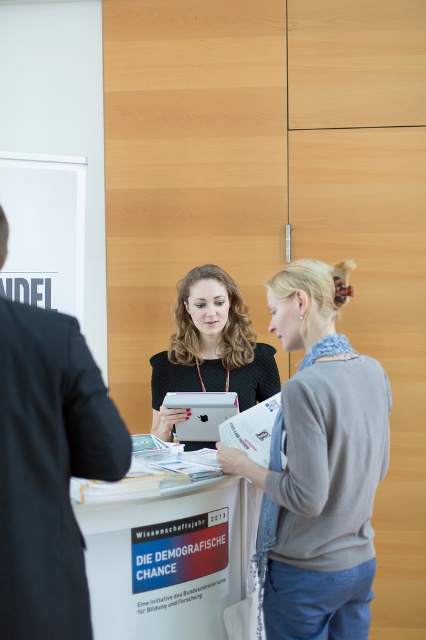
Question: Is gray sweater at center wider than white cardboard sign at center?

Choices:
 (A) no
 (B) yes

Answer: (A)

Question: Can you confirm if black suit at left is positioned below matte black tablet at center?

Choices:
 (A) no
 (B) yes

Answer: (B)

Question: Which point appears closest to the camera in this image?

Choices:
 (A) (210, 636)
 (B) (339, 534)
 (C) (199, 358)

Answer: (B)

Question: Can you confirm if white cardboard sign at center is smaller than matte black tablet at center?

Choices:
 (A) no
 (B) yes

Answer: (A)

Question: Which point appears closest to the camera in this image?

Choices:
 (A) (17, 470)
 (B) (201, 291)
 (C) (166, 488)
 (D) (273, 524)

Answer: (A)

Question: Among these points, which one is farthest from the camera?

Choices:
 (A) (333, 378)
 (B) (129, 490)
 (C) (261, 365)

Answer: (C)